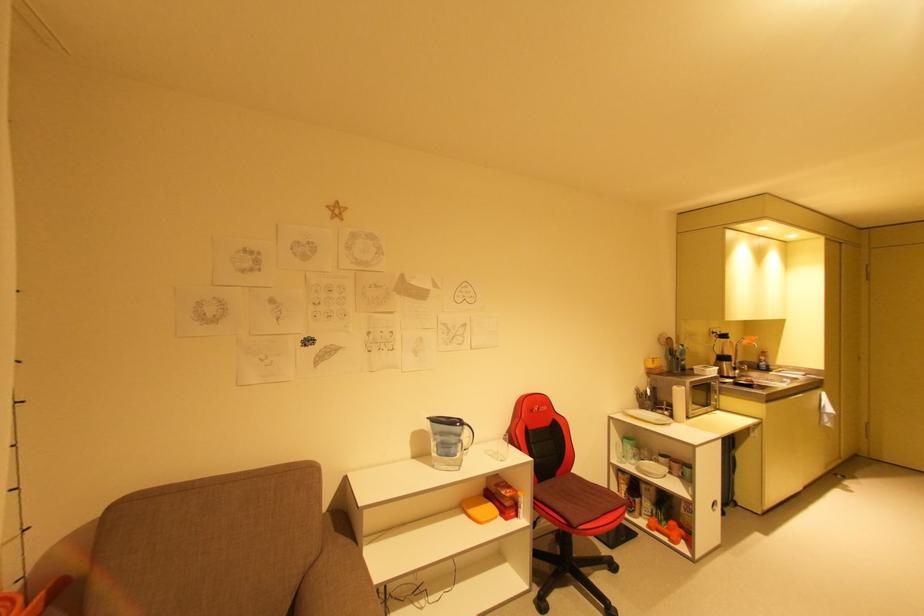
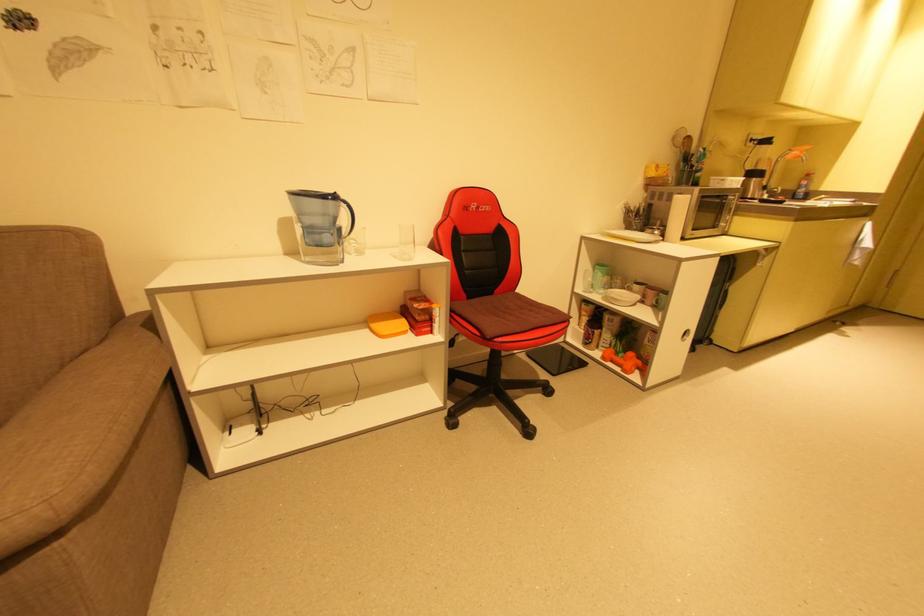
In the second image, find the point that corresponds to the point at 469,427 in the first image.

(346, 204)